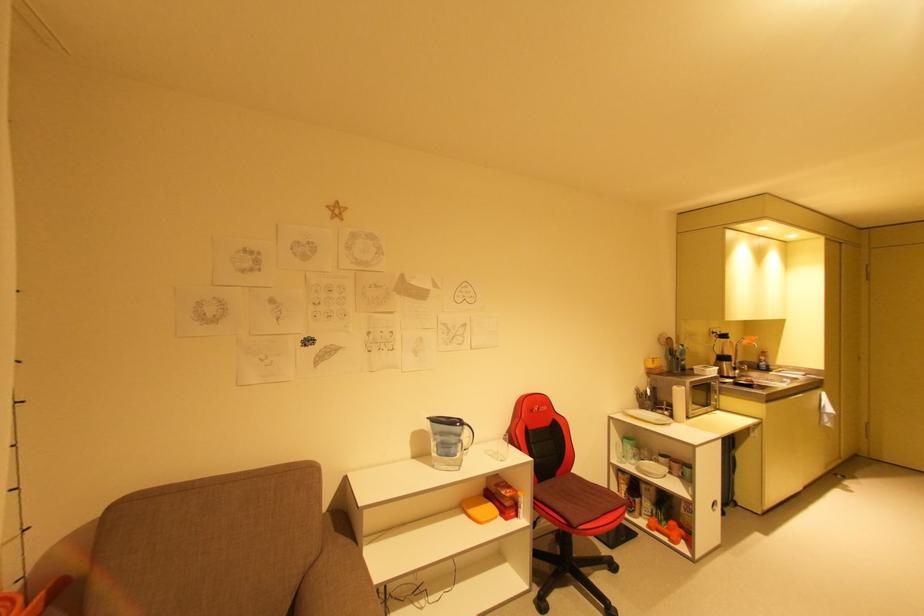
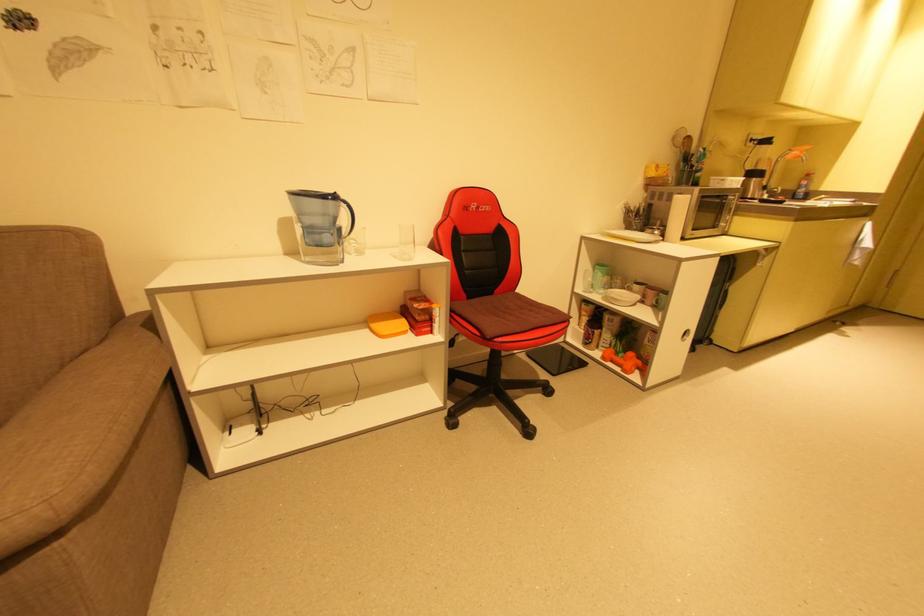
In the second image, find the point that corresponds to the point at 469,427 in the first image.

(346, 204)